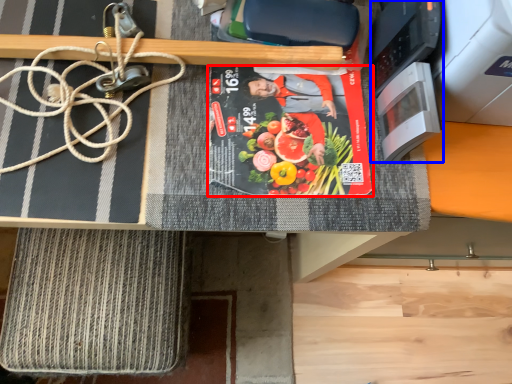
Question: Which object is further to the camera taking this photo, paperback book (highlighted by a red box) or appliance (highlighted by a blue box)?

Choices:
 (A) paperback book
 (B) appliance

Answer: (A)